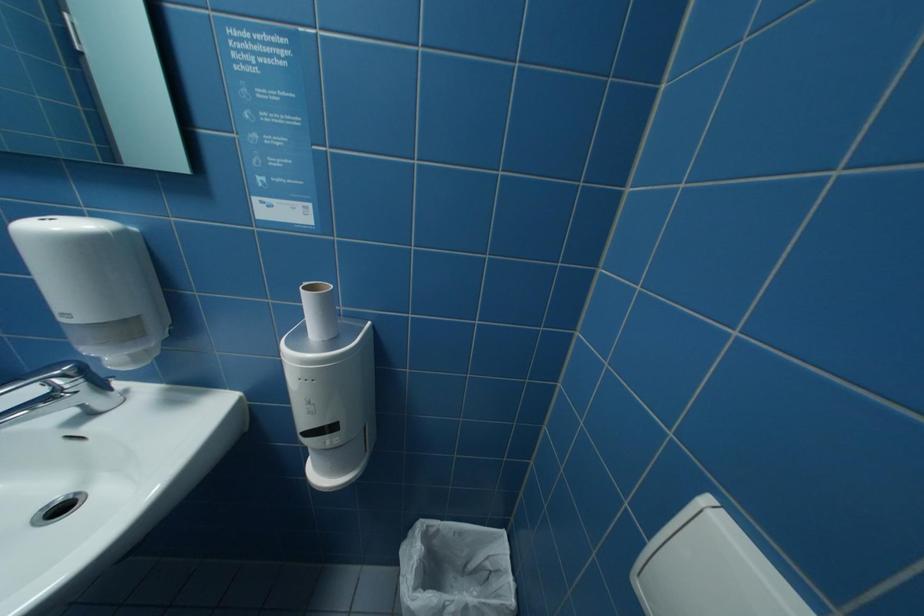
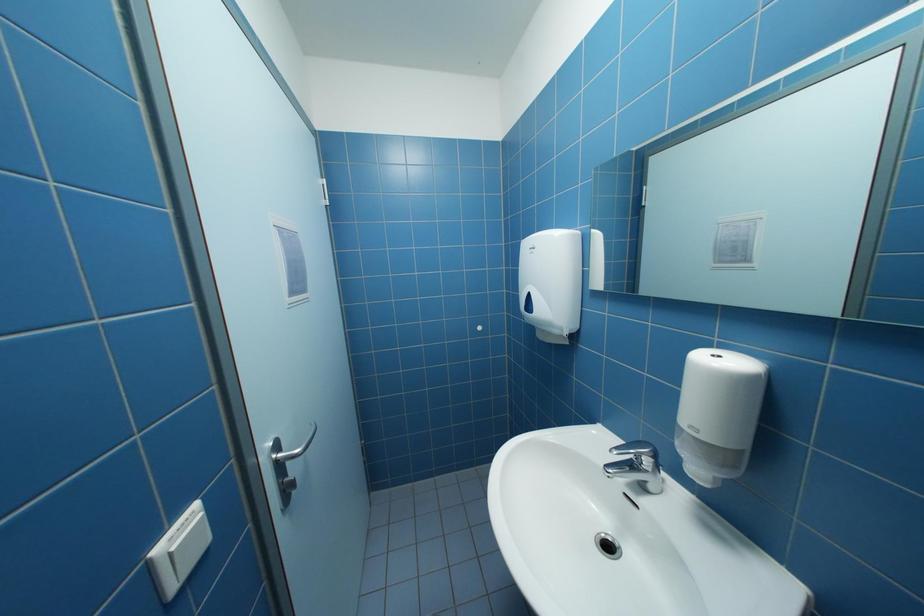
Question: The first image is from the beginning of the video and the second image is from the end. How did the camera likely rotate when shooting the video?

Choices:
 (A) Left
 (B) Right
 (C) Up
 (D) Down

Answer: (A)